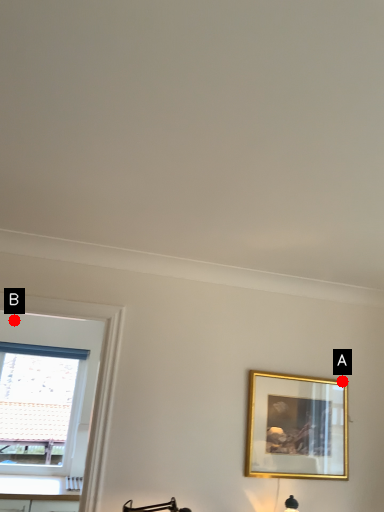
Question: Two points are circled on the image, labeled by A and B beside each circle. Which point is closer to the camera taking this photo?

Choices:
 (A) A is closer
 (B) B is closer

Answer: (A)